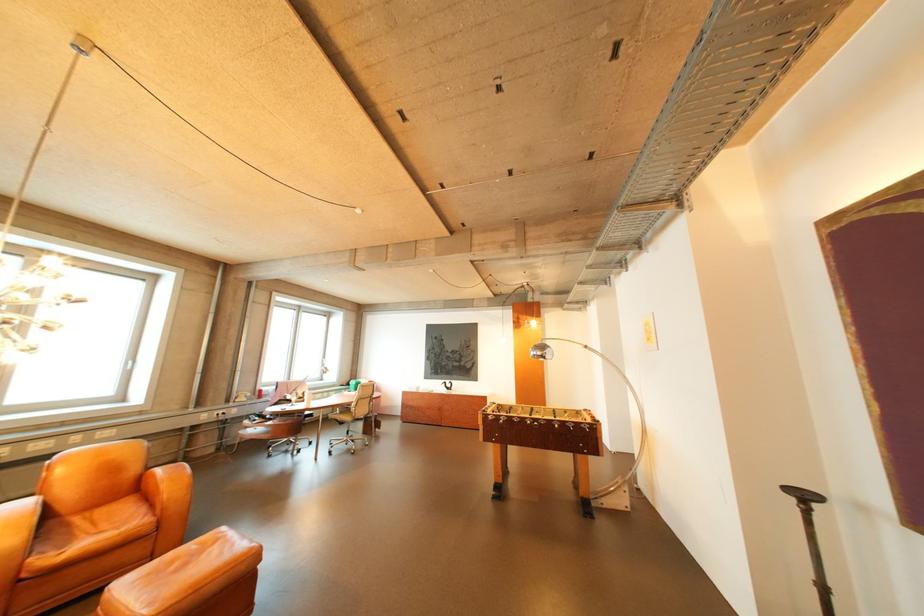
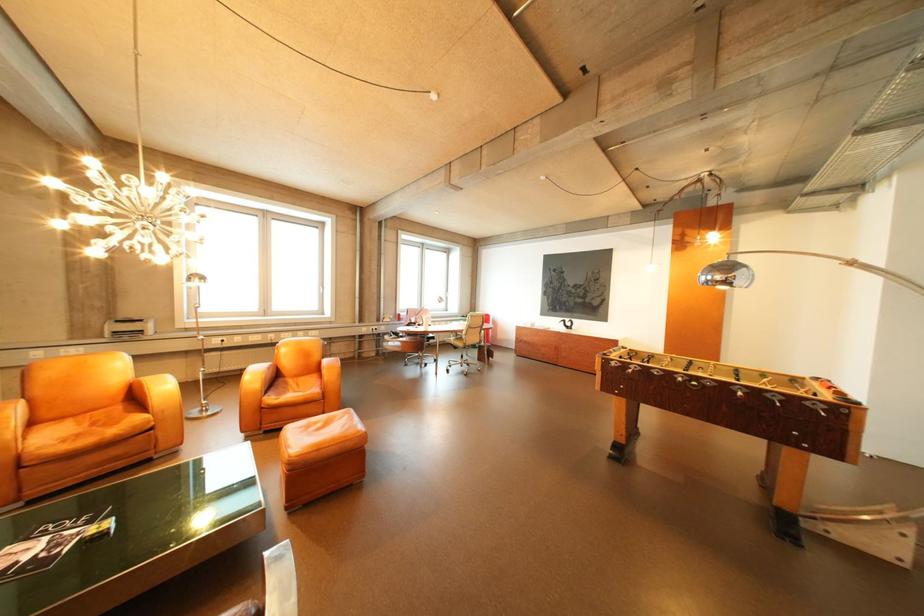
Locate, in the second image, the point that corresponds to (552,354) in the first image.

(732, 278)